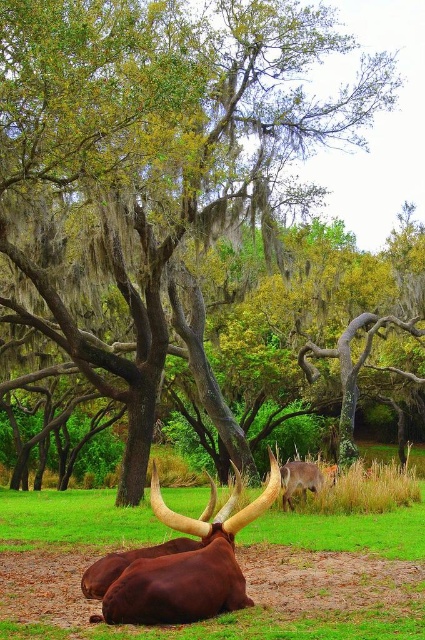
You are standing in the middle of the scene and want to walk towards the two points marked in the image. Which point, point (226, 513) or point (280, 477), will you reach first?

Point (226, 513) is in front of point (280, 477), so you will reach point (226, 513) first.